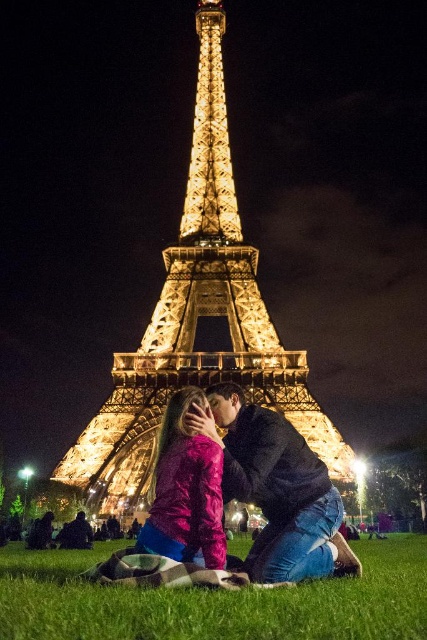
Between point (239, 454) and point (177, 408), which one is positioned behind?

Point (177, 408)

Is point (269, 536) positioned behind point (207, 472)?

Yes, it is.

Locate an element on the screen. This screenshot has height=640, width=427. black matte jacket at center is located at coordinates (274, 486).

Is green grass at lower center smaller than shiny pink jacket at center?

Actually, green grass at lower center might be larger than shiny pink jacket at center.

Is green grass at lower center further to camera compared to shiny pink jacket at center?

No, it is in front of shiny pink jacket at center.

I want to click on green grass at lower center, so click(215, 600).

At what (x,y) coordinates should I click in order to perform the action: click on green grass at lower center. Please return your answer as a coordinate pair (x, y). Looking at the image, I should click on (215, 600).

Does point (420, 577) lie behind point (321, 534)?

Yes, point (420, 577) is behind point (321, 534).

Who is lower down, green grass at lower center or black matte jacket at center?

Positioned lower is green grass at lower center.

Does point (46, 586) come closer to viewer compared to point (263, 497)?

Yes, point (46, 586) is in front of point (263, 497).

I want to click on green grass at lower center, so click(215, 600).